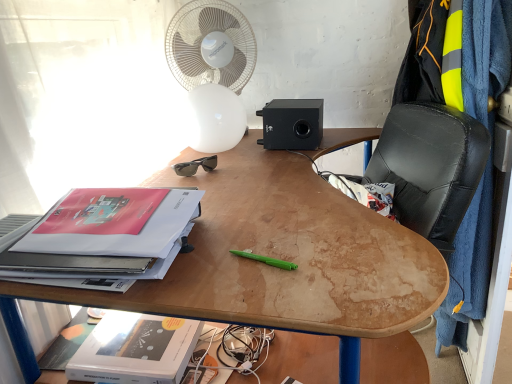
Image resolution: width=512 pixels, height=384 pixels. Identify the location of vacant space to the right of black plastic sunglasses at upper center. (252, 162).